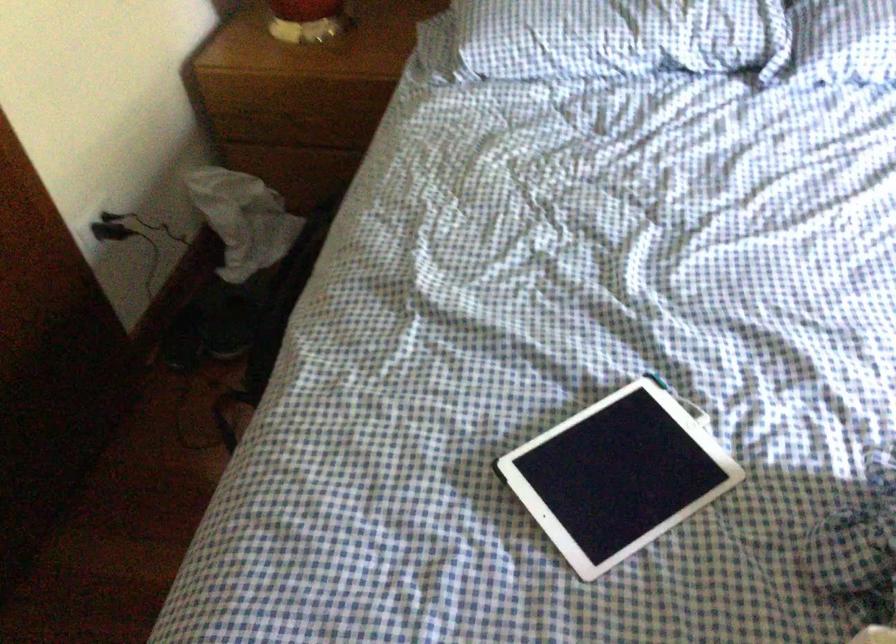
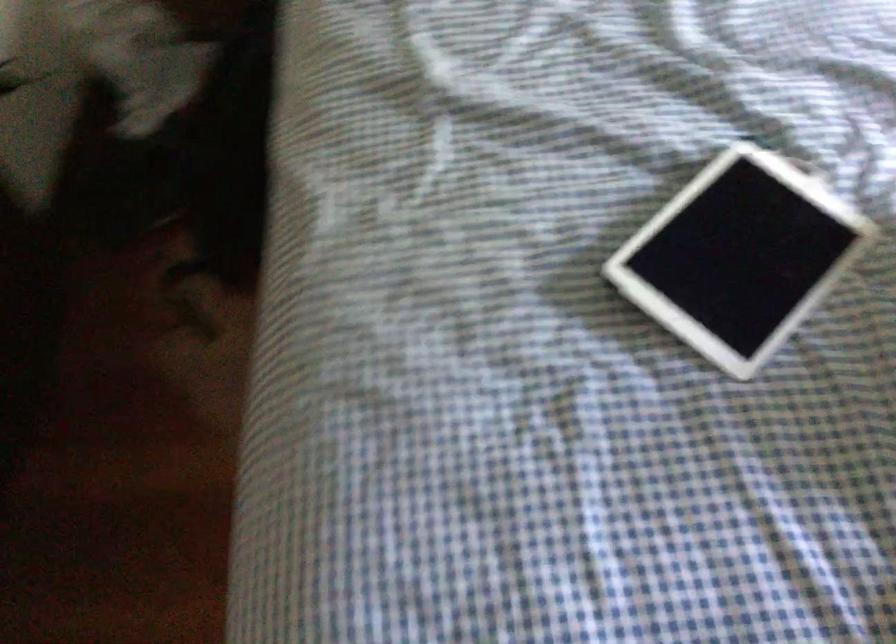
In a continuous first-person perspective shot, in which direction is the camera moving?

The cameraman walked toward left, forward.